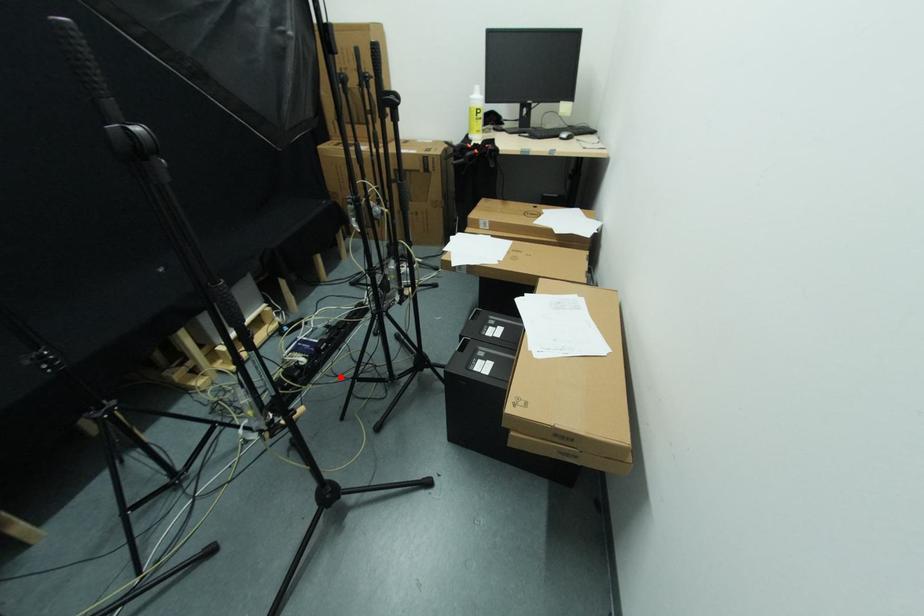
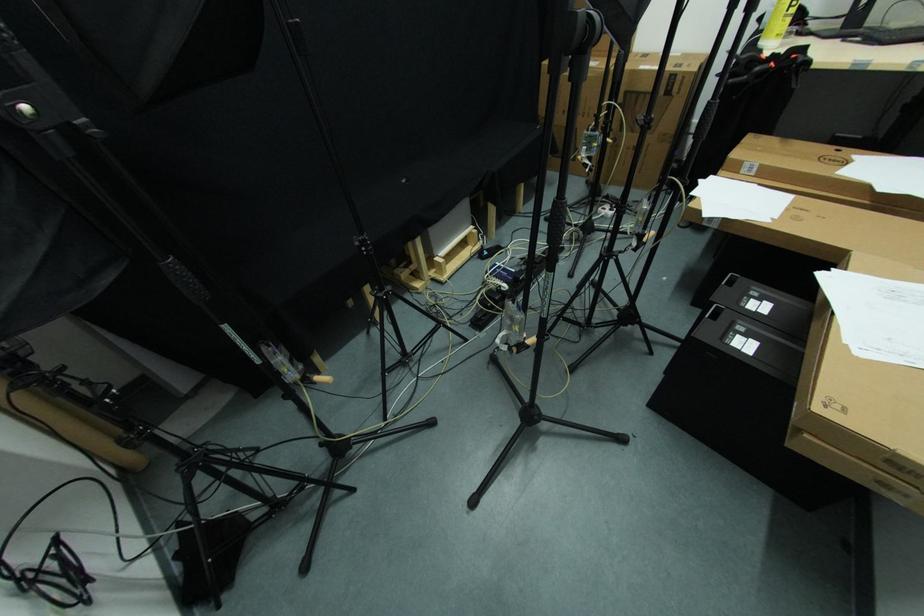
Question: I am providing you with two images of the same scene from different viewpoints. In image1, a red point is highlighted. Considering the same 3D point in image2, which of the following is correct?

Choices:
 (A) It is closer
 (B) It is farther

Answer: (B)